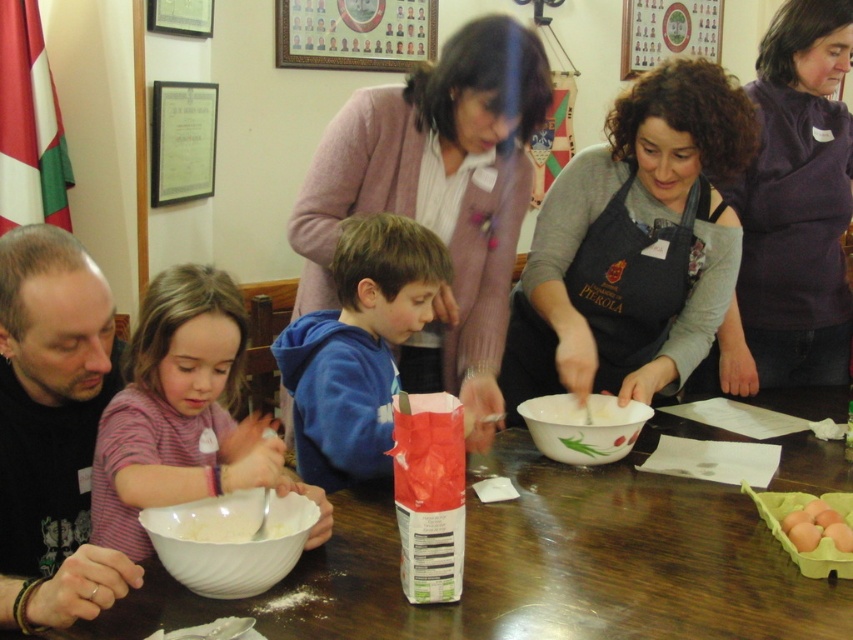
You are a participant in the cooking activity and need to reach for the white glossy bowl at center while standing near the blue fleece hoodie at center. Can you comfortably reach the bowl without moving your position?

The blue fleece hoodie at center is 14.33 inches away from the white glossy bowl at center, so yes, you can comfortably reach the bowl without moving your position since the distance is within a typical comfortable reaching range.

You are a chef preparing to place a new ingredient into the white glossy bowl at center. However, you notice the blue fleece hoodie at center is nearby. Based on their sizes, do you think the hoodie might block access to the bowl?

The blue fleece hoodie at center is bigger than the white glossy bowl at center, so it might block access to the bowl.